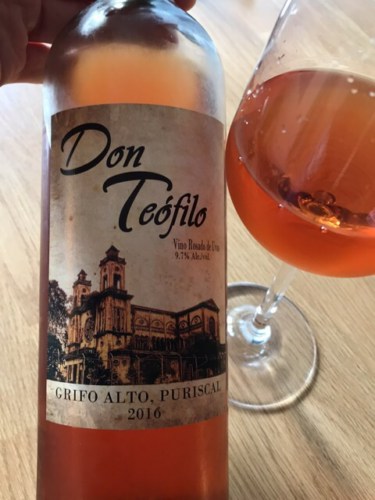
Identify the location of glass base. Image resolution: width=375 pixels, height=500 pixels. (276, 378).